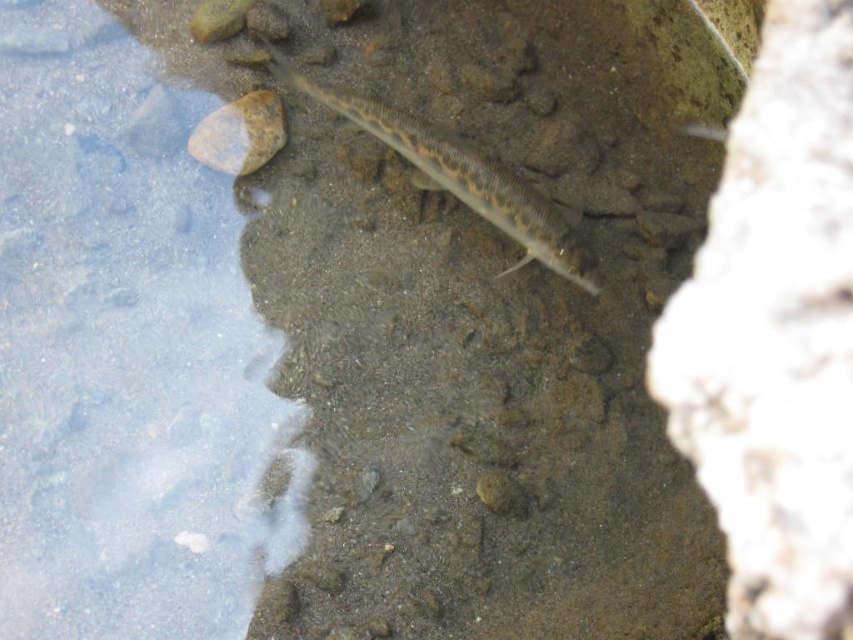
Who is taller, clear water at left or sandy brown fish at center?

clear water at left is taller.

Is point (134, 369) positioned after point (469, 205)?

Yes, point (134, 369) is farther from viewer.

Who is more distant from viewer, [123,403] or [309,92]?

The point [123,403] is behind.

Locate an element on the screen. This screenshot has height=640, width=853. clear water at left is located at coordinates (125, 353).

Is the position of sandy brown fish at center less distant than that of brown rough rock at upper left?

That is True.

Which is behind, point (524, 232) or point (193, 129)?

The point (193, 129) is more distant.

Where is `sandy brown fish at center`? Image resolution: width=853 pixels, height=640 pixels. sandy brown fish at center is located at coordinates (463, 177).

Does clear water at left appear under brown rough rock at upper left?

Correct, clear water at left is located below brown rough rock at upper left.

From the picture: Between clear water at left and brown rough rock at upper left, which one is positioned lower?

clear water at left is below.

Describe the element at coordinates (125, 353) in the screenshot. I see `clear water at left` at that location.

Find the location of a particular element. The width and height of the screenshot is (853, 640). clear water at left is located at coordinates (125, 353).